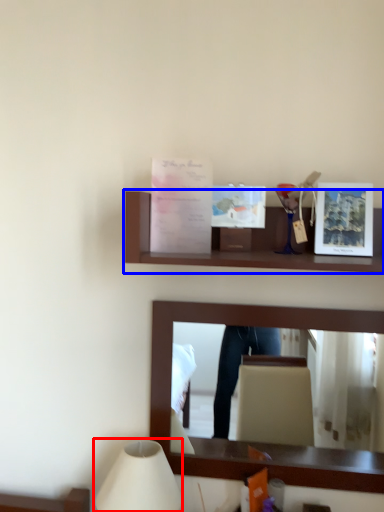
Question: Which of the following is the closest to the observer, table lamp (highlighted by a red box) or shelf (highlighted by a blue box)?

Choices:
 (A) table lamp
 (B) shelf

Answer: (B)